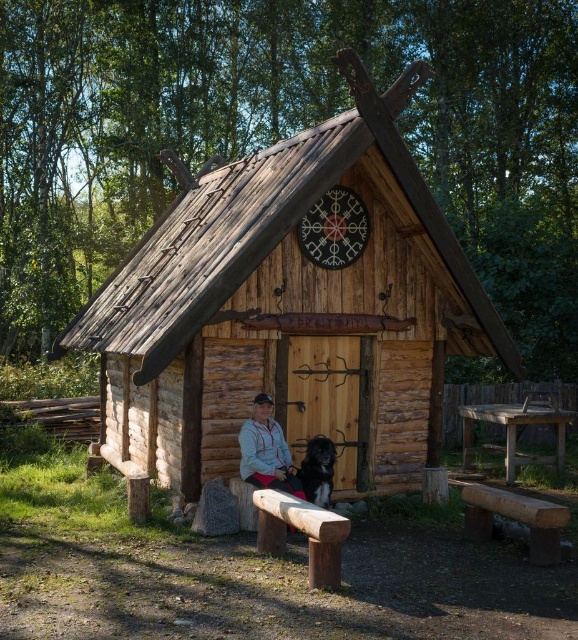
Question: Can you confirm if smooth wooden bench at center is thinner than smooth wooden bench at lower right?

Choices:
 (A) no
 (B) yes

Answer: (A)

Question: Which of the following is the closest to the observer?

Choices:
 (A) (320, 586)
 (B) (331, 465)
 (C) (553, 502)

Answer: (A)

Question: Is smooth wooden bench at center bigger than smooth wooden bench at lower right?

Choices:
 (A) yes
 (B) no

Answer: (A)

Question: Among these points, which one is nearest to the camera?

Choices:
 (A) (244, 472)
 (B) (316, 492)

Answer: (B)

Question: Which point is closer to the camera?

Choices:
 (A) (550, 538)
 (B) (283, 371)

Answer: (A)

Question: Does wooden picnic table at right appear on the left side of black fur dog at lower center?

Choices:
 (A) yes
 (B) no

Answer: (B)